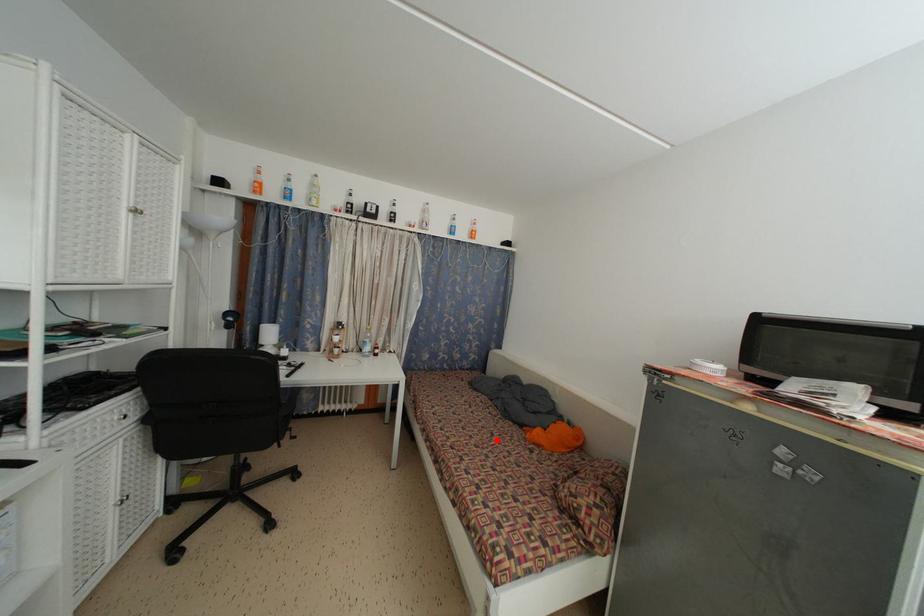
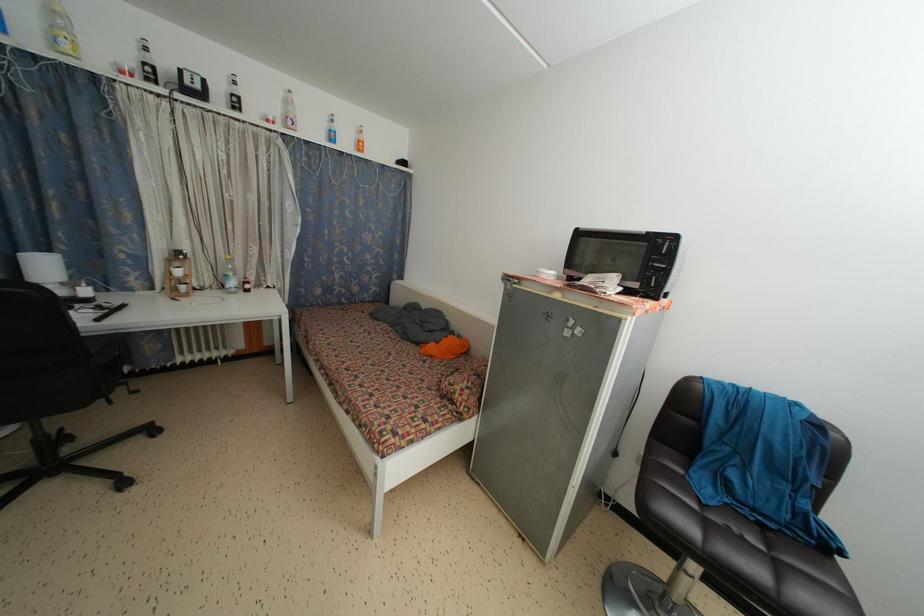
Find the pixel in the second image that matches the highlighted location in the first image.

(394, 360)